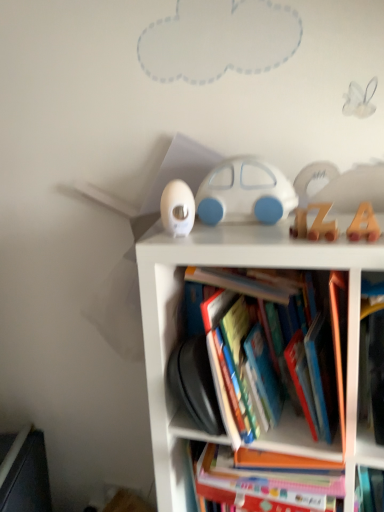
Find the location of a particular element. This screenshot has height=512, width=384. vacant region to the right of white plastic thermometer at upper left, acting as the second toy starting from the back is located at coordinates (230, 230).